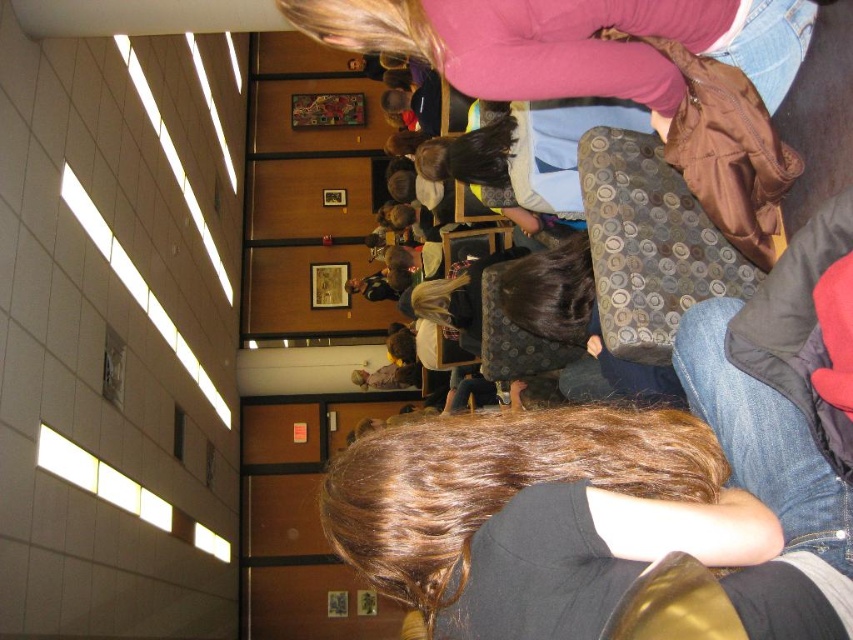
Question: Does pink fleece sweater at upper center have a greater width compared to matte gray backpack at center?

Choices:
 (A) yes
 (B) no

Answer: (A)

Question: Which of the following is the farthest from the observer?

Choices:
 (A) matte gray backpack at center
 (B) pink fleece sweater at upper center

Answer: (A)

Question: Is pink fleece sweater at upper center positioned in front of matte gray backpack at center?

Choices:
 (A) no
 (B) yes

Answer: (B)

Question: Which point appears closest to the camera in this image?

Choices:
 (A) (460, 147)
 (B) (398, 12)

Answer: (B)

Question: From the image, what is the correct spatial relationship of pink fleece sweater at upper center in relation to matte gray backpack at center?

Choices:
 (A) right
 (B) left

Answer: (B)